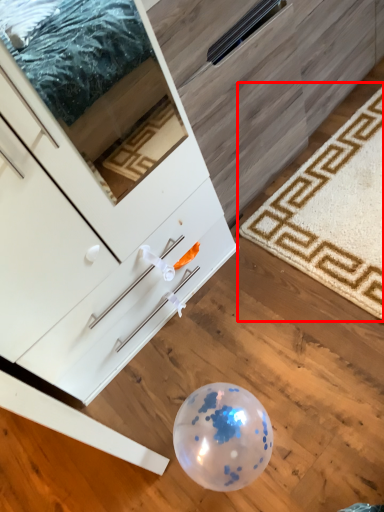
Question: From the image, what is the correct spatial relationship of mat (annotated by the red box) in relation to chest of drawers?

Choices:
 (A) left
 (B) right

Answer: (B)